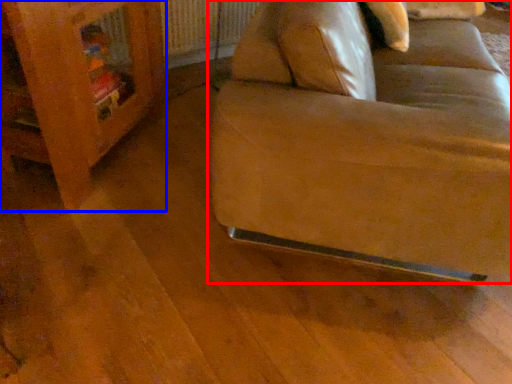
Question: Which of the following is the farthest to the observer, studio couch (highlighted by a red box) or furniture (highlighted by a blue box)?

Choices:
 (A) studio couch
 (B) furniture

Answer: (B)